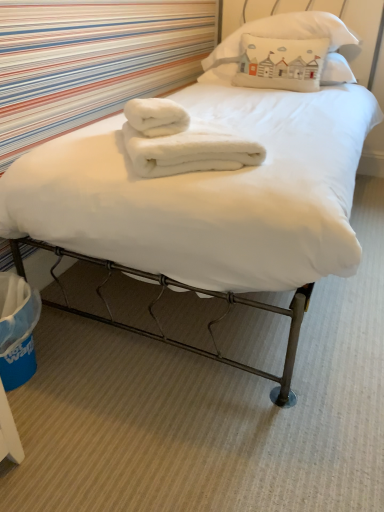
Question: In which direction should I rotate to look at white fluffy bath towel at center, the first bath towel ordered from the bottom?

Choices:
 (A) left
 (B) right

Answer: (A)

Question: In which direction should I rotate to look at white cotton pillow at upper center, which is the second pillow from top to bottom?

Choices:
 (A) right
 (B) left

Answer: (A)

Question: Are white cotton pillow at upper center, which ranks as the third pillow in bottom-to-top order, and white fluffy bath towel at center, acting as the second bath towel starting from the top, located far from each other?

Choices:
 (A) no
 (B) yes

Answer: (B)

Question: Is white cotton pillow at upper center, the first pillow viewed from the top, oriented towards white fluffy bath towel at center, acting as the second bath towel starting from the top?

Choices:
 (A) no
 (B) yes

Answer: (B)

Question: Does white cotton pillow at upper center, the first pillow viewed from the top, have a greater width compared to white fluffy bath towel at center, the first bath towel ordered from the bottom?

Choices:
 (A) no
 (B) yes

Answer: (B)

Question: Is white cotton pillow at upper center, which ranks as the third pillow in bottom-to-top order, surrounding white fluffy bath towel at center, the first bath towel ordered from the bottom?

Choices:
 (A) yes
 (B) no

Answer: (B)

Question: Is white cotton pillow at upper center, the first pillow viewed from the top, not inside white fluffy bath towel at center, acting as the second bath towel starting from the top?

Choices:
 (A) no
 (B) yes

Answer: (B)

Question: Does white cotton pillow at upper center, which ranks as the third pillow in bottom-to-top order, have a greater height compared to white fluffy bath towel at center, the first bath towel ordered from the bottom?

Choices:
 (A) yes
 (B) no

Answer: (A)

Question: From a real-world perspective, is white fluffy bath towel at center, acting as the second bath towel starting from the top, located higher than white fluffy towel at center, arranged as the 1th bath towel when viewed from the top?

Choices:
 (A) no
 (B) yes

Answer: (A)

Question: Can you confirm if white fluffy bath towel at center, acting as the second bath towel starting from the top, is taller than white fluffy towel at center, which appears as the second bath towel when ordered from the bottom?

Choices:
 (A) no
 (B) yes

Answer: (B)

Question: Is white fluffy bath towel at center, the first bath towel ordered from the bottom, outside white fluffy towel at center, arranged as the 1th bath towel when viewed from the top?

Choices:
 (A) no
 (B) yes

Answer: (B)

Question: Is white fluffy bath towel at center, the first bath towel ordered from the bottom, bigger than white fluffy towel at center, which appears as the second bath towel when ordered from the bottom?

Choices:
 (A) yes
 (B) no

Answer: (A)

Question: Is white fluffy bath towel at center, acting as the second bath towel starting from the top, smaller than white fluffy towel at center, which appears as the second bath towel when ordered from the bottom?

Choices:
 (A) no
 (B) yes

Answer: (A)

Question: Does white fluffy bath towel at center, the first bath towel ordered from the bottom, have a lesser width compared to white fluffy towel at center, which appears as the second bath towel when ordered from the bottom?

Choices:
 (A) no
 (B) yes

Answer: (A)

Question: Is the position of white cotton pillow at upper center, which ranks as the third pillow in bottom-to-top order, less distant than that of white fluffy towel at center, arranged as the 1th bath towel when viewed from the top?

Choices:
 (A) yes
 (B) no

Answer: (B)